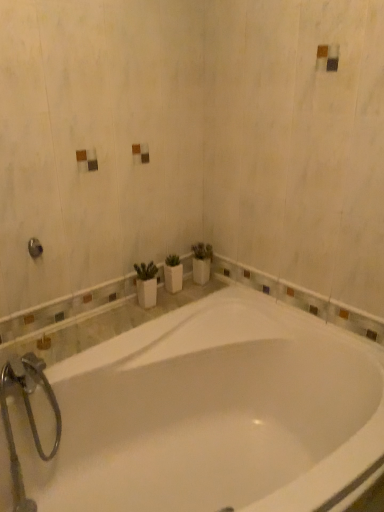
Question: Relative to white glossy bathtub at center, is brushed metal shower at upper left in front or behind?

Choices:
 (A) front
 (B) behind

Answer: (B)

Question: In the image, is brushed metal shower at upper left on the left side or the right side of white glossy bathtub at center?

Choices:
 (A) left
 (B) right

Answer: (A)

Question: Considering the positions of point (34, 248) and point (155, 473), is point (34, 248) closer or farther from the camera than point (155, 473)?

Choices:
 (A) farther
 (B) closer

Answer: (B)

Question: From the image's perspective, is white glossy bathtub at center located above or below brushed metal shower at upper left?

Choices:
 (A) above
 (B) below

Answer: (B)

Question: From a real-world perspective, relative to brushed metal shower at upper left, is white glossy bathtub at center vertically above or below?

Choices:
 (A) above
 (B) below

Answer: (B)

Question: Considering the positions of point (248, 417) and point (29, 251), is point (248, 417) closer or farther from the camera than point (29, 251)?

Choices:
 (A) farther
 (B) closer

Answer: (A)

Question: Considering the positions of white glossy bathtub at center and brushed metal shower at upper left in the image, is white glossy bathtub at center taller or shorter than brushed metal shower at upper left?

Choices:
 (A) short
 (B) tall

Answer: (B)